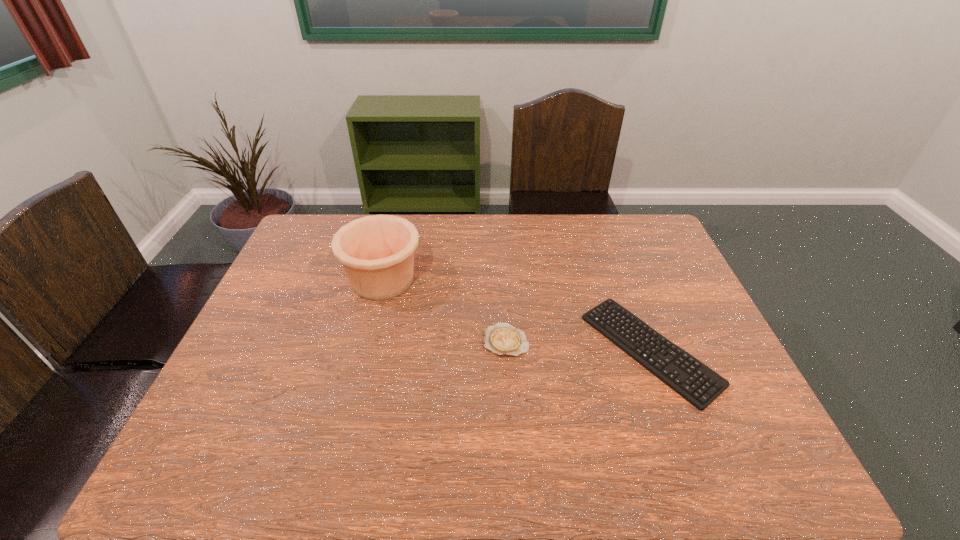
Image resolution: width=960 pixels, height=540 pixels. Find the location of `vacant space at the left edge`. vacant space at the left edge is located at coordinates (238, 413).

Identify the location of vacant area at the right edge. (680, 282).

Find the location of a particular element. vacant region at the far left corner of the desktop is located at coordinates (324, 246).

This screenshot has width=960, height=540. I want to click on unoccupied position between the quiche and the pottery, so click(x=444, y=310).

Image resolution: width=960 pixels, height=540 pixels. I want to click on empty space between the tallest object and the computer keyboard, so click(516, 315).

Find the location of a particular element. The image size is (960, 540). free area in between the tallest object and the rightmost object is located at coordinates (516, 315).

At what (x,y) coordinates should I click in order to perform the action: click on free space between the second object from right to left and the leftmost object. Please return your answer as a coordinate pair (x, y). Looking at the image, I should click on (444, 310).

Where is `free space between the second object from right to left and the pottery`? free space between the second object from right to left and the pottery is located at coordinates (444, 310).

At what (x,y) coordinates should I click in order to perform the action: click on vacant space in between the second object from right to left and the computer keyboard. Please return your answer as a coordinate pair (x, y). This screenshot has height=540, width=960. Looking at the image, I should click on (578, 345).

Where is `free point between the leftmost object and the second object from right to left`? This screenshot has width=960, height=540. free point between the leftmost object and the second object from right to left is located at coordinates (444, 310).